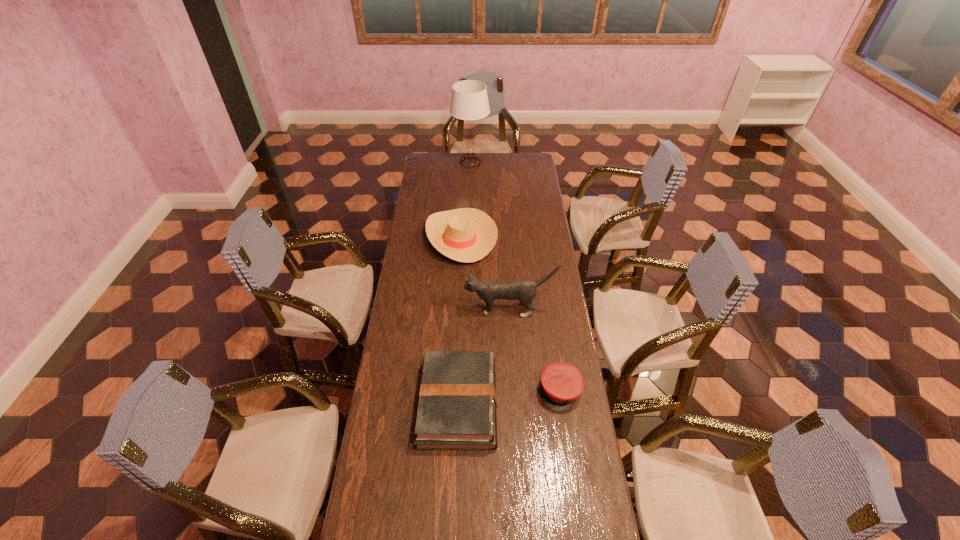
This screenshot has width=960, height=540. I want to click on free region at the left edge of the desktop, so click(x=443, y=183).

Where is `free space at the right edge of the desktop`? This screenshot has width=960, height=540. free space at the right edge of the desktop is located at coordinates (576, 444).

This screenshot has width=960, height=540. Find the location of `free space at the far left corner of the desktop`. free space at the far left corner of the desktop is located at coordinates (428, 165).

The width and height of the screenshot is (960, 540). In order to click on free space between the cat and the cap in this screenshot , I will do `click(535, 350)`.

The image size is (960, 540). In order to click on vacant point located between the cap and the farthest object in this screenshot , I will do `click(516, 277)`.

Find the location of a particular element. This screenshot has height=540, width=960. free space between the fourth nearest object and the second shortest object is located at coordinates (460, 320).

Locate an element on the screen. This screenshot has height=540, width=960. empty location between the second farthest object and the cap is located at coordinates (511, 314).

Where is `vacant region between the fourth nearest object and the hardback book`? The width and height of the screenshot is (960, 540). vacant region between the fourth nearest object and the hardback book is located at coordinates (460, 320).

At what (x,y) coordinates should I click in order to perform the action: click on unoccupied area between the shortest object and the second farthest object. Please return your answer as a coordinate pair (x, y). The height and width of the screenshot is (540, 960). Looking at the image, I should click on (511, 314).

Where is `vacant space in between the shortest object and the tallest object`? The width and height of the screenshot is (960, 540). vacant space in between the shortest object and the tallest object is located at coordinates click(516, 277).